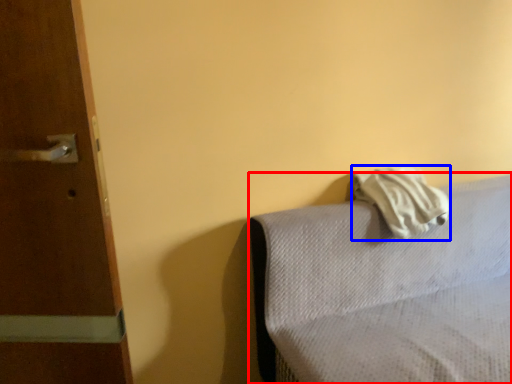
Question: Which object is further to the camera taking this photo, furniture (highlighted by a red box) or bath towel (highlighted by a blue box)?

Choices:
 (A) furniture
 (B) bath towel

Answer: (B)